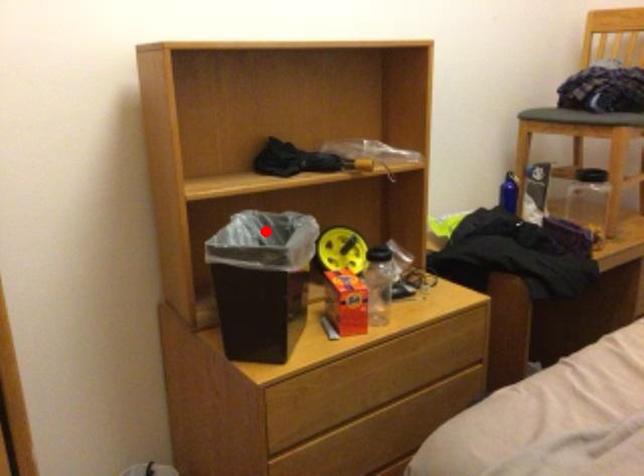
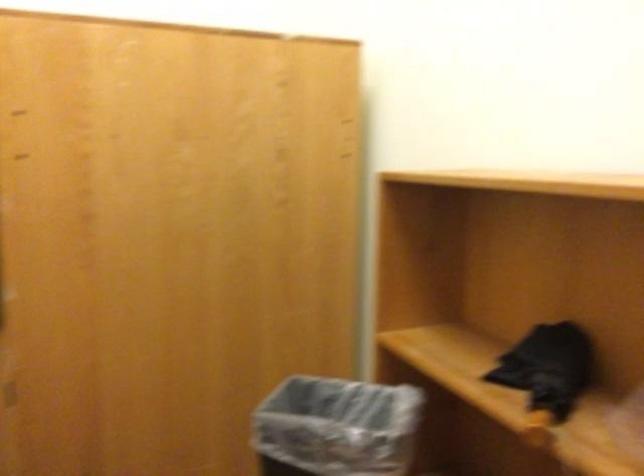
Question: I am providing you with two images of the same scene from different viewpoints. In image1, a red point is highlighted. Considering the same 3D point in image2, which of the following is correct?

Choices:
 (A) It is closer
 (B) It is farther

Answer: (A)